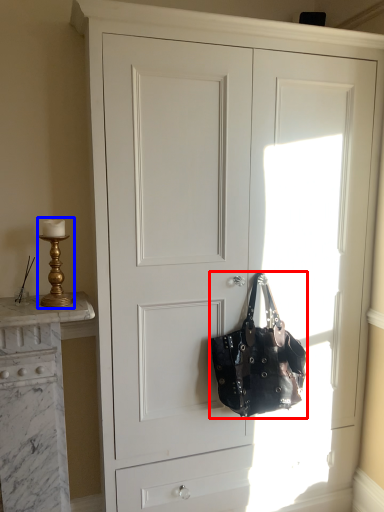
Question: Among these objects, which one is nearest to the camera, handbag (highlighted by a red box) or table lamp (highlighted by a blue box)?

Choices:
 (A) handbag
 (B) table lamp

Answer: (B)